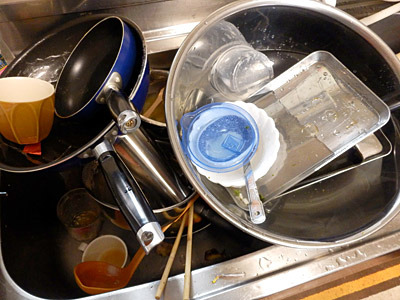
Image resolution: width=400 pixels, height=300 pixels. In order to click on silver part of rim around sink in this screenshot , I will do `click(276, 264)`.